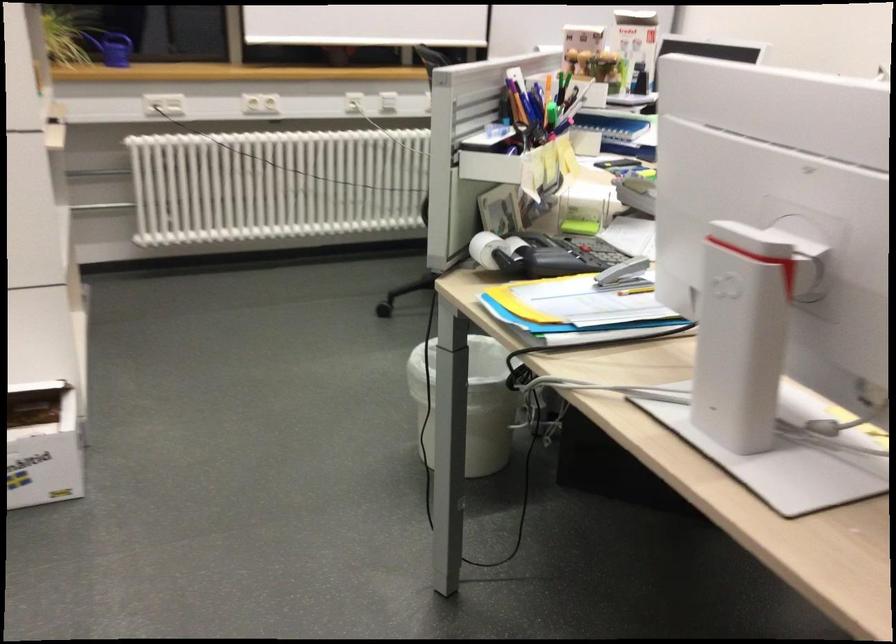
Find the location of a particular element. This screenshot has width=896, height=644. white paper roll is located at coordinates (485, 249).